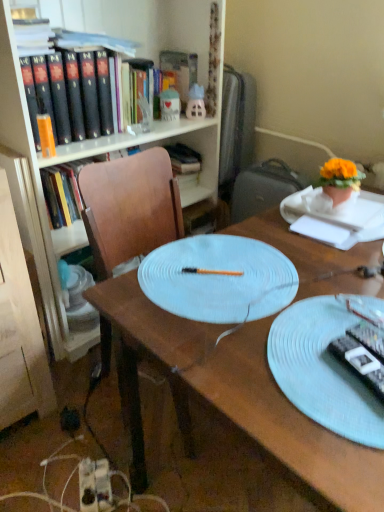
Identify the location of vacant space that's between orange fabric flower pot at upper right and black plastic remote control at right, arranged as the 2th remote control when viewed from the left. The image size is (384, 512). (348, 263).